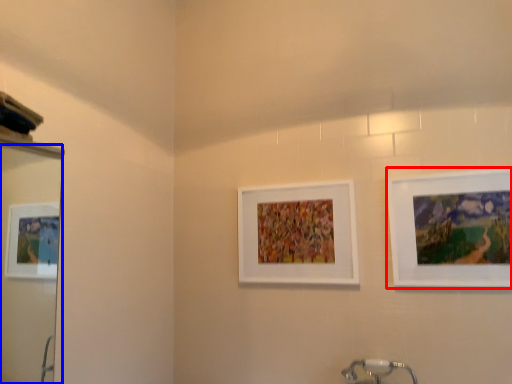
Question: Which of the following is the farthest to the observer, picture frame (highlighted by a red box) or mirror (highlighted by a blue box)?

Choices:
 (A) picture frame
 (B) mirror

Answer: (A)